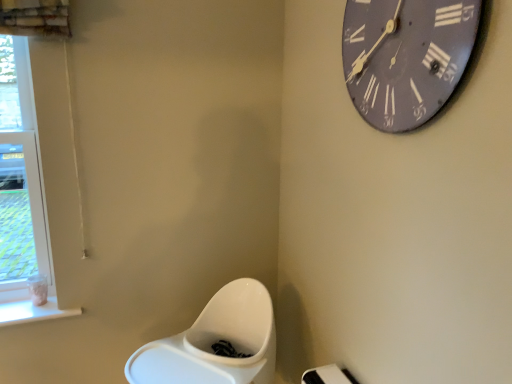
Question: Is matte gray clock at upper right inside or outside of clear glass window at left?

Choices:
 (A) inside
 (B) outside

Answer: (B)

Question: Looking at the image, does matte gray clock at upper right seem bigger or smaller compared to clear glass window at left?

Choices:
 (A) big
 (B) small

Answer: (B)

Question: Considering the positions of point (346, 69) and point (8, 233), is point (346, 69) closer or farther from the camera than point (8, 233)?

Choices:
 (A) farther
 (B) closer

Answer: (B)

Question: From their relative heights in the image, would you say clear glass window at left is taller or shorter than matte gray clock at upper right?

Choices:
 (A) tall
 (B) short

Answer: (A)

Question: Is clear glass window at left wider or thinner than matte gray clock at upper right?

Choices:
 (A) wide
 (B) thin

Answer: (A)

Question: From the image's perspective, is clear glass window at left positioned above or below matte gray clock at upper right?

Choices:
 (A) below
 (B) above

Answer: (A)

Question: Relative to matte gray clock at upper right, is clear glass window at left in front or behind?

Choices:
 (A) front
 (B) behind

Answer: (B)